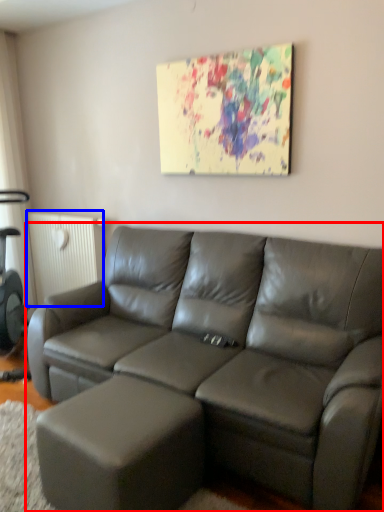
Question: Which object appears closest to the camera in this image, studio couch (highlighted by a red box) or radiator (highlighted by a blue box)?

Choices:
 (A) studio couch
 (B) radiator

Answer: (A)